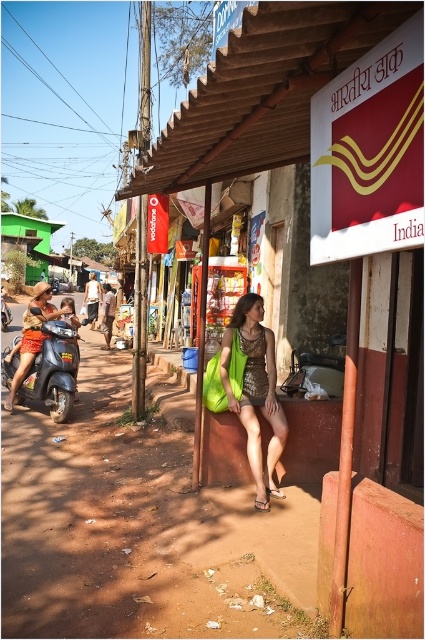
Question: Which object is farther from the camera taking this photo?

Choices:
 (A) brown woven bag at center
 (B) light brown cotton shirt at center
 (C) green fabric shoulder bag at center

Answer: (B)

Question: Can you confirm if metallic blue scooter at left is smaller than brown woven bag at center?

Choices:
 (A) yes
 (B) no

Answer: (A)

Question: Which point is closer to the camera taking this photo?

Choices:
 (A) (85, 307)
 (B) (203, 401)

Answer: (B)

Question: Which object is farther from the camera taking this photo?

Choices:
 (A) matte green bag at center
 (B) light brown cotton shirt at center

Answer: (B)

Question: Can you confirm if metallic blue scooter at left is positioned to the right of green fabric shoulder bag at center?

Choices:
 (A) yes
 (B) no

Answer: (B)

Question: Does red fabric sign at upper center come in front of matte green bag at center?

Choices:
 (A) no
 (B) yes

Answer: (B)